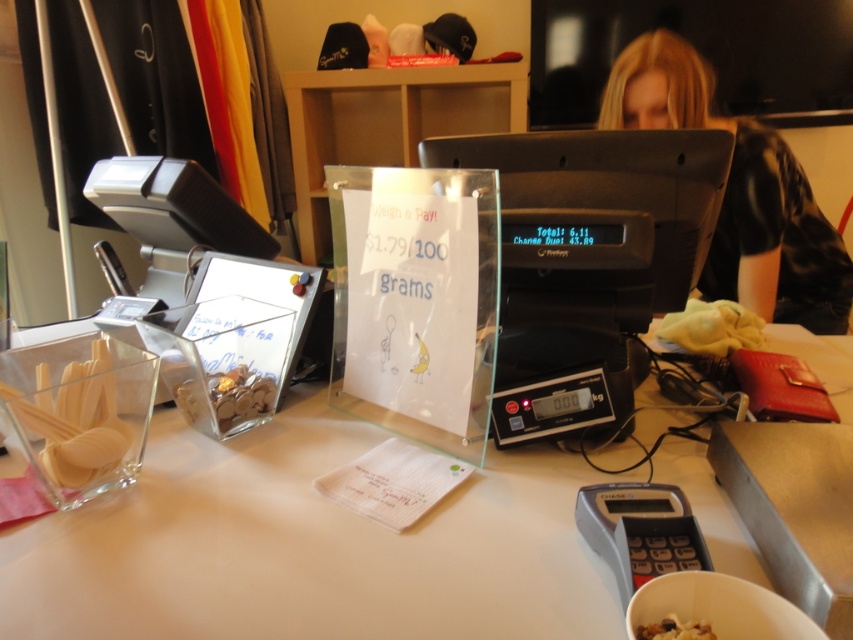
Question: Which object appears closest to the camera in this image?

Choices:
 (A) blonde hair at upper right
 (B) black plastic scale at lower right
 (C) golden crumbly pastry at lower center
 (D) clear plastic container at left

Answer: (C)

Question: Which point is farther to the camera?

Choices:
 (A) golden crumbly pastry at lower center
 (B) clear plastic container at left
 (C) blonde hair at upper right
 (D) black plastic scale at lower right

Answer: (C)

Question: Can you confirm if blonde hair at upper right is thinner than translucent plastic bag of nuts at center?

Choices:
 (A) yes
 (B) no

Answer: (B)

Question: Which is nearer to the golden crumbly pastry at lower center?

Choices:
 (A) black plastic scale at lower right
 (B) white matte table at center
 (C) clear plastic container at left

Answer: (A)

Question: Can you confirm if black plastic scale at center is positioned to the left of black plastic scale at lower right?

Choices:
 (A) no
 (B) yes

Answer: (A)

Question: Is blonde hair at upper right positioned in front of black plastic scale at lower right?

Choices:
 (A) no
 (B) yes

Answer: (A)